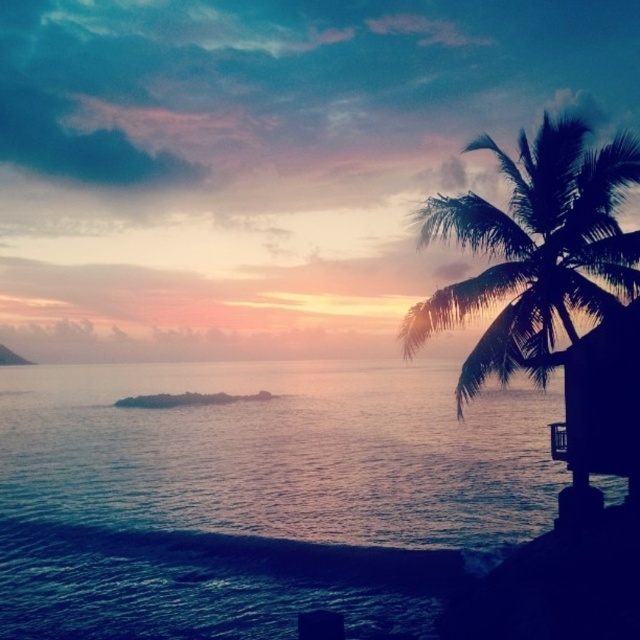
You are a photographer planning to capture the sunset scene. You want to ensure that both the blue water at center and the dark brown wooden hut at right are clearly visible in your shot. Given their sizes, which object should you focus on to frame the scene properly?

The blue water at center is larger in size than the dark brown wooden hut at right, so focusing on the blue water at center would help frame the scene properly as it occupies more space in the composition.

You are planning to set up a small bench between the silhouette leafy palm at right and the dark brown wooden hut at right for a sunset viewing spot. Given that the bench requires 5 feet of space, will there be enough room?

The distance between the silhouette leafy palm at right and the dark brown wooden hut at right is 4.19 feet, which is less than the required 5 feet for the bench. Therefore, there isn not enough space to place the bench between them.